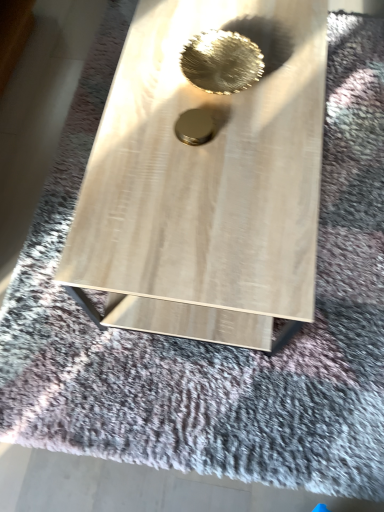
What are the coordinates of `vacant space to the right of gold metallic circle at center, arranged as the first hole when ordered from the bottom` in the screenshot? It's located at (266, 125).